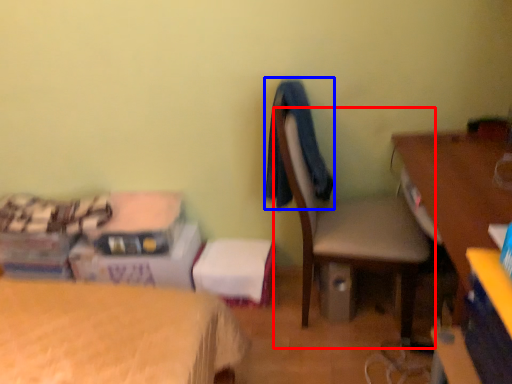
Question: Which object appears farthest to the camera in this image, chair (highlighted by a red box) or clothing (highlighted by a blue box)?

Choices:
 (A) chair
 (B) clothing

Answer: (B)